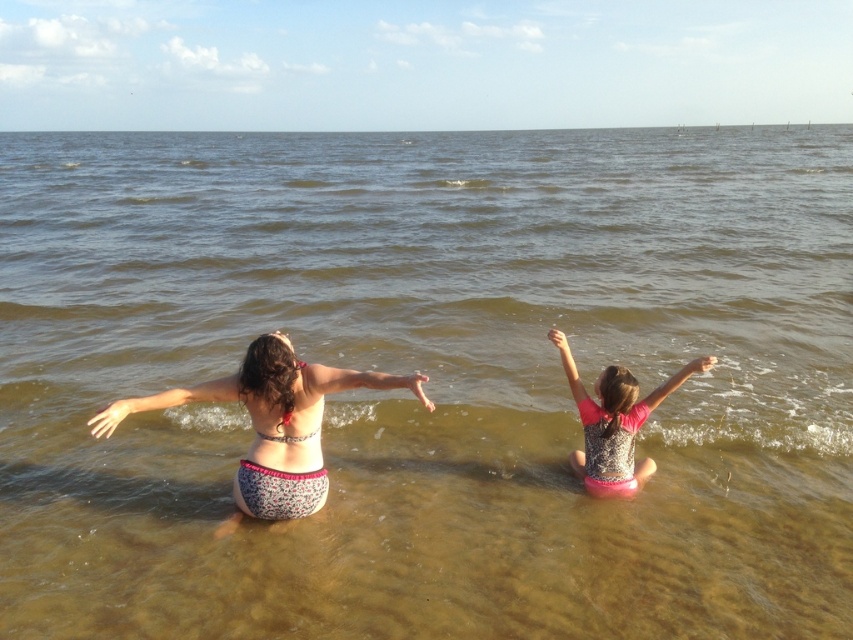
Question: Which of the following is the closest to the observer?

Choices:
 (A) (598, 472)
 (B) (248, 454)

Answer: (B)

Question: Is floral fabric bikini bottom at center positioned behind pink sequined swimsuit at center?

Choices:
 (A) no
 (B) yes

Answer: (A)

Question: Which object appears farthest from the camera in this image?

Choices:
 (A) pink sequined swimsuit at center
 (B) floral fabric bikini bottom at center

Answer: (A)

Question: Does floral fabric bikini bottom at center have a larger size compared to pink sequined swimsuit at center?

Choices:
 (A) no
 (B) yes

Answer: (B)

Question: Can you confirm if floral fabric bikini bottom at center is positioned above pink sequined swimsuit at center?

Choices:
 (A) yes
 (B) no

Answer: (B)

Question: Among these objects, which one is nearest to the camera?

Choices:
 (A) pink sequined swimsuit at center
 (B) floral fabric bikini bottom at center

Answer: (B)